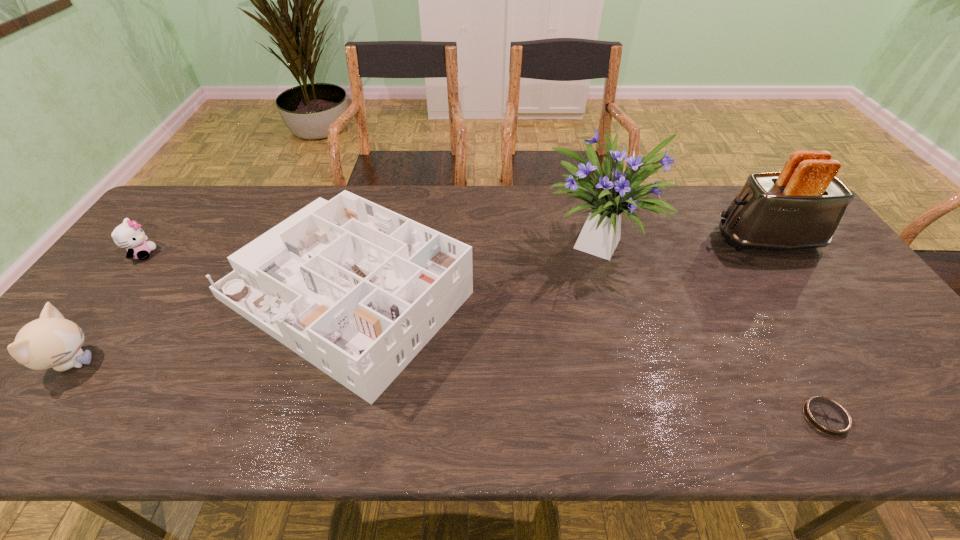
Identify the location of the third object from right to left. (612, 192).

You are a GUI agent. You are given a task and a screenshot of the screen. Output one action in this format:
    pyautogui.click(x=<x>, y=<y>)
    Task: Click on the tallest object
    
    Given the screenshot: What is the action you would take?
    pyautogui.click(x=612, y=192)

Find the location of a particular element. The image size is (960, 540). the second tallest object is located at coordinates (x=800, y=207).

The height and width of the screenshot is (540, 960). I want to click on dollhouse, so click(x=357, y=290).

Identify the location of the taller kitten. This screenshot has width=960, height=540. (51, 341).

Where is `the farther kitten`? The image size is (960, 540). the farther kitten is located at coordinates (128, 235).

Find the location of a particular element. the fifth tallest object is located at coordinates (128, 235).

Where is `the shortest object`? The height and width of the screenshot is (540, 960). the shortest object is located at coordinates (827, 416).

Locate an element on the screen. blank space located on the front of the third object from right to left is located at coordinates (645, 396).

The height and width of the screenshot is (540, 960). I want to click on free space located on the side of the fifth shortest object with the control lever, so click(613, 240).